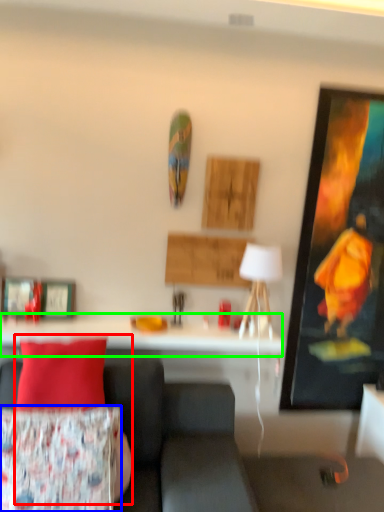
Question: Which is nearer to the person (highlighted by a red box)? pillow (highlighted by a blue box) or table (highlighted by a green box).

Choices:
 (A) pillow
 (B) table

Answer: (A)